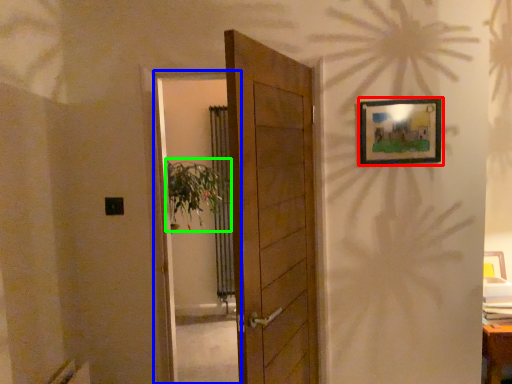
Question: Which object is positioned farthest from picture frame (highlighted by a red box)? Select from screen door (highlighted by a blue box) and plant (highlighted by a green box).

Choices:
 (A) screen door
 (B) plant

Answer: (A)